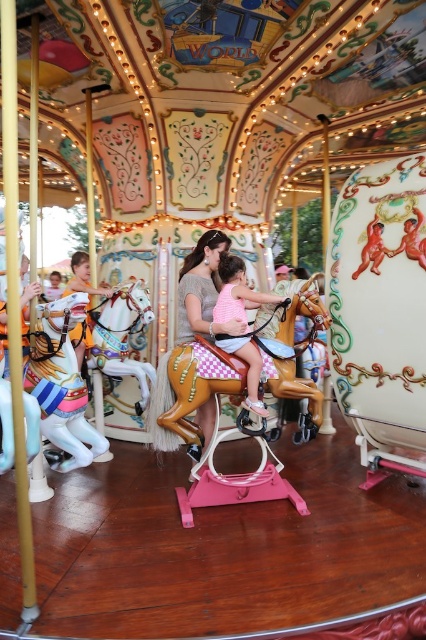
Question: Can you confirm if painted wood horse at left is positioned to the left of light brown wooden horse at left?

Choices:
 (A) yes
 (B) no

Answer: (B)

Question: Does wooden polished horse at center have a smaller size compared to painted wood horse at left?

Choices:
 (A) yes
 (B) no

Answer: (B)

Question: Does painted wood horse at left have a greater width compared to light brown wooden horse at left?

Choices:
 (A) no
 (B) yes

Answer: (A)

Question: Which point is closer to the camera?

Choices:
 (A) (78, 262)
 (B) (247, 368)
 (C) (189, 396)

Answer: (C)

Question: Which of these objects is positioned closest to the wooden polished horse at center?

Choices:
 (A) light brown wooden horse at left
 (B) shiny silver horse at center
 (C) painted wood horse at left
 (D) pink cotton dress at center

Answer: (D)

Question: Considering the real-world distances, which object is farthest from the light brown wooden horse at left?

Choices:
 (A) matte pink dress at center
 (B) pink cotton dress at center

Answer: (B)